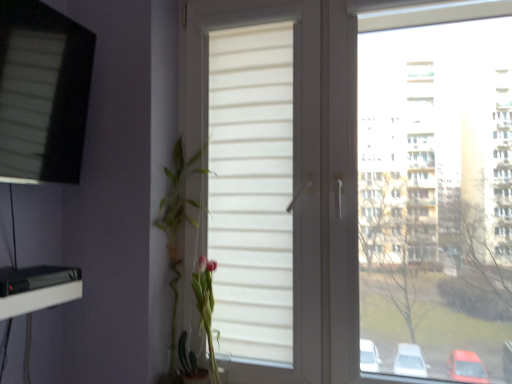
Question: From their relative heights in the image, would you say green leafy plant at left is taller or shorter than white matte window at center, the first window when ordered from right to left?

Choices:
 (A) short
 (B) tall

Answer: (A)

Question: Looking at the image, does green leafy plant at left seem bigger or smaller compared to white matte window at center, which is the 2th window in left-to-right order?

Choices:
 (A) small
 (B) big

Answer: (A)

Question: Estimate the real-world distances between objects in this image. Which object is closer to the white matte window at center, the first window when ordered from right to left?

Choices:
 (A) green leafy plant at left
 (B) matte black screen at upper left, the first window from the left

Answer: (A)

Question: Estimate the real-world distances between objects in this image. Which object is farther from the green leafy plant at left?

Choices:
 (A) white matte window at center, the first window when ordered from right to left
 (B) matte black screen at upper left, the first window from the left

Answer: (B)